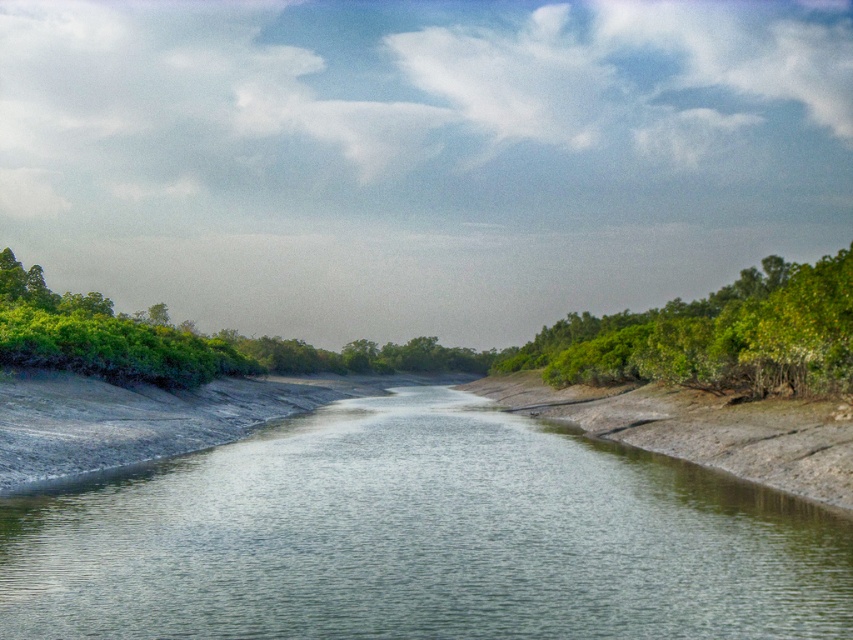
Question: Which point is farther to the camera?

Choices:
 (A) green leafy shrub at left
 (B) green leafy trees at right
 (C) clear water at center

Answer: (A)

Question: Does clear water at center appear on the right side of green leafy trees at right?

Choices:
 (A) no
 (B) yes

Answer: (A)

Question: Is clear water at center thinner than green leafy shrub at left?

Choices:
 (A) yes
 (B) no

Answer: (A)

Question: Based on their relative distances, which object is farther from the green leafy shrub at left?

Choices:
 (A) green leafy trees at right
 (B) clear water at center

Answer: (A)

Question: Which point is closer to the camera?

Choices:
 (A) (799, 380)
 (B) (531, 534)
 (C) (152, 337)

Answer: (B)

Question: Can you confirm if clear water at center is positioned to the right of green leafy trees at right?

Choices:
 (A) no
 (B) yes

Answer: (A)